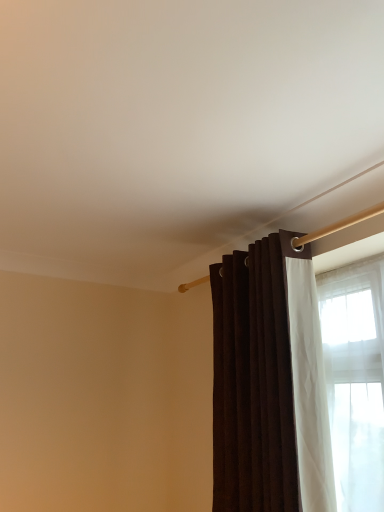
Image resolution: width=384 pixels, height=512 pixels. What do you see at coordinates (269, 382) in the screenshot?
I see `brown velvet curtain at right` at bounding box center [269, 382].

I want to click on brown velvet curtain at right, so click(269, 382).

The width and height of the screenshot is (384, 512). I want to click on brown velvet curtain at right, so click(269, 382).